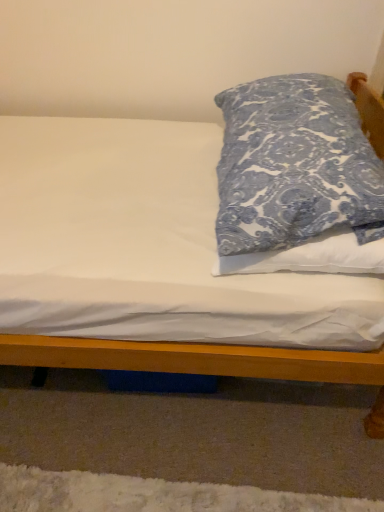
Question: Does blue printed fabric pillow at upper right appear on the left side of white matte bed at center?

Choices:
 (A) no
 (B) yes

Answer: (A)

Question: Is the depth of blue printed fabric pillow at upper right less than that of white matte bed at center?

Choices:
 (A) yes
 (B) no

Answer: (A)

Question: Is blue printed fabric pillow at upper right shorter than white matte bed at center?

Choices:
 (A) yes
 (B) no

Answer: (B)

Question: Can you confirm if blue printed fabric pillow at upper right is thinner than white matte bed at center?

Choices:
 (A) no
 (B) yes

Answer: (B)

Question: Does blue printed fabric pillow at upper right contain white matte bed at center?

Choices:
 (A) no
 (B) yes

Answer: (A)

Question: Are blue printed fabric pillow at upper right and white matte bed at center located far from each other?

Choices:
 (A) no
 (B) yes

Answer: (A)

Question: Would you say blue printed fabric pillow at upper right is part of white matte bed at center's contents?

Choices:
 (A) no
 (B) yes

Answer: (A)

Question: From the image's perspective, does white matte bed at center appear lower than blue printed fabric pillow at upper right?

Choices:
 (A) yes
 (B) no

Answer: (A)

Question: Is white matte bed at center placed right next to blue printed fabric pillow at upper right?

Choices:
 (A) yes
 (B) no

Answer: (B)

Question: From a real-world perspective, is white matte bed at center on blue printed fabric pillow at upper right?

Choices:
 (A) no
 (B) yes

Answer: (A)

Question: Does white matte bed at center have a greater height compared to blue printed fabric pillow at upper right?

Choices:
 (A) yes
 (B) no

Answer: (B)

Question: From the image's perspective, is white matte bed at center located above blue printed fabric pillow at upper right?

Choices:
 (A) no
 (B) yes

Answer: (A)

Question: Would you say white matte bed at center is inside or outside blue printed fabric pillow at upper right?

Choices:
 (A) outside
 (B) inside

Answer: (A)